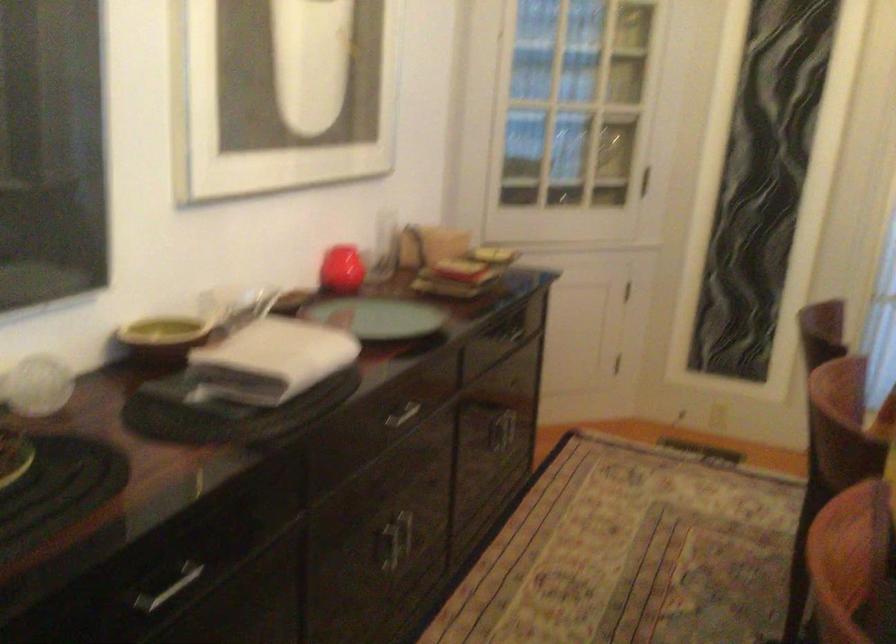
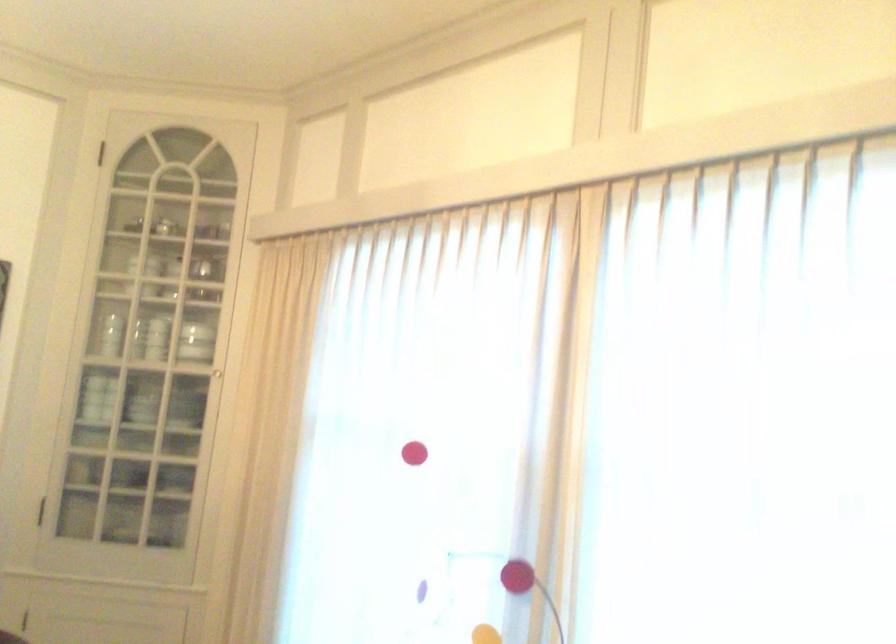
Question: Based on the continuous images, in which direction is the camera rotating? Reply with the corresponding letter.

Choices:
 (A) Left
 (B) Right
 (C) Up
 (D) Down

Answer: (B)